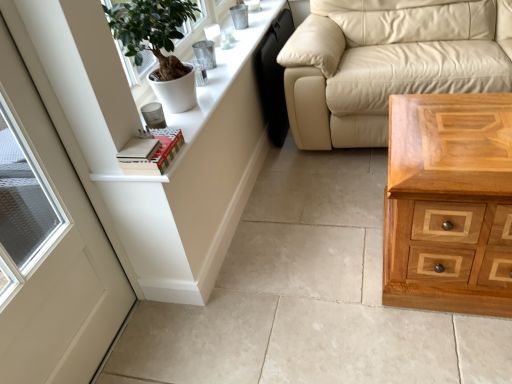
Where is `light brown wood chest of drawers at lower right`? light brown wood chest of drawers at lower right is located at coordinates point(449,203).

The width and height of the screenshot is (512, 384). I want to click on white wood dresser at upper left, so click(198, 178).

Where is `beige leather couch at upper right`? This screenshot has height=384, width=512. beige leather couch at upper right is located at coordinates (384, 64).

Is white matte pot at upper left situated inside white matte door at left or outside?

white matte pot at upper left exists outside the volume of white matte door at left.

Find the location of a particular element. The height and width of the screenshot is (384, 512). houseplant lying behind the white matte door at left is located at coordinates (152, 32).

Is white matte pot at upper left wider or thinner than white matte door at left?

Considering their sizes, white matte pot at upper left looks broader than white matte door at left.

Can you confirm if hardcover book at upper left is bigger than white wood dresser at upper left?

Incorrect, hardcover book at upper left is not larger than white wood dresser at upper left.

Does hardcover book at upper left lie behind white wood dresser at upper left?

No, hardcover book at upper left is in front of white wood dresser at upper left.

Is hardcover book at upper left turned away from white wood dresser at upper left?

hardcover book at upper left is not turned away from white wood dresser at upper left.

Does point (132, 159) come closer to viewer compared to point (259, 125)?

Yes, point (132, 159) is closer to viewer.

Based on the photo, which object is further away from the camera taking this photo, beige leather couch at upper right or light brown wood chest of drawers at lower right?

beige leather couch at upper right is behind.

Considering the relative sizes of beige leather couch at upper right and light brown wood chest of drawers at lower right in the image provided, is beige leather couch at upper right shorter than light brown wood chest of drawers at lower right?

Incorrect, the height of beige leather couch at upper right does not fall short of that of light brown wood chest of drawers at lower right.

Is light brown wood chest of drawers at lower right completely or partially inside beige leather couch at upper right?

No, light brown wood chest of drawers at lower right is not a part of beige leather couch at upper right.

In the scene shown: How many degrees apart are the facing directions of beige leather couch at upper right and light brown wood chest of drawers at lower right?

They differ by 0.23 degrees in their facing directions.

From a real-world perspective, which is physically above, light brown wood chest of drawers at lower right or beige leather couch at upper right?

beige leather couch at upper right, from a real-world perspective.

Is light brown wood chest of drawers at lower right closer to the viewer compared to beige leather couch at upper right?

Yes, it is in front of beige leather couch at upper right.

What are the coordinates of `studio couch above the light brown wood chest of drawers at lower right (from the image's perspective)` in the screenshot? It's located at (384, 64).

Which object is positioned more to the right, light brown wood chest of drawers at lower right or beige leather couch at upper right?

beige leather couch at upper right.

Does light brown wood chest of drawers at lower right turn towards hardcover book at upper left?

No.

Is the position of light brown wood chest of drawers at lower right more distant than that of hardcover book at upper left?

No, it is in front of hardcover book at upper left.

Are light brown wood chest of drawers at lower right and hardcover book at upper left far apart?

No, light brown wood chest of drawers at lower right is in close proximity to hardcover book at upper left.

Is light brown wood chest of drawers at lower right a part of white wood dresser at upper left?

No, light brown wood chest of drawers at lower right is not inside white wood dresser at upper left.

Is point (141, 252) farther from camera compared to point (467, 272)?

Yes, it is behind point (467, 272).

Is white wood dresser at upper left not close to light brown wood chest of drawers at lower right?

Actually, white wood dresser at upper left and light brown wood chest of drawers at lower right are a little close together.

Is white matte door at left taller than light brown wood chest of drawers at lower right?

Indeed, white matte door at left has a greater height compared to light brown wood chest of drawers at lower right.

Where is `door above the light brown wood chest of drawers at lower right (from a real-world perspective)`? door above the light brown wood chest of drawers at lower right (from a real-world perspective) is located at coordinates (56, 238).

Which object is further away from the camera taking this photo, white matte door at left or light brown wood chest of drawers at lower right?

Positioned behind is light brown wood chest of drawers at lower right.

Can you confirm if white matte door at left is positioned to the right of light brown wood chest of drawers at lower right?

In fact, white matte door at left is to the left of light brown wood chest of drawers at lower right.

Image resolution: width=512 pixels, height=384 pixels. In order to click on door below the white matte pot at upper left (from the image's perspective) in this screenshot , I will do `click(56, 238)`.

I want to click on dresser beneath the hardcover book at upper left (from a real-world perspective), so click(x=198, y=178).

Based on their spatial positions, is white matte pot at upper left or white matte door at left further from beige leather couch at upper right?

Among the two, white matte door at left is located further to beige leather couch at upper right.

Estimate the real-world distances between objects in this image. Which object is closer to white matte pot at upper left, white matte door at left or hardcover book at upper left?

Among the two, hardcover book at upper left is located nearer to white matte pot at upper left.

From the image, which object appears to be nearer to hardcover book at upper left, white matte pot at upper left or beige leather couch at upper right?

white matte pot at upper left.

Estimate the real-world distances between objects in this image. Which object is further from white wood dresser at upper left, light brown wood chest of drawers at lower right or hardcover book at upper left?

The object further to white wood dresser at upper left is light brown wood chest of drawers at lower right.

Which object lies further to the anchor point white matte pot at upper left, white wood dresser at upper left or beige leather couch at upper right?

beige leather couch at upper right lies further to white matte pot at upper left than the other object.

Considering their positions, is beige leather couch at upper right positioned further to light brown wood chest of drawers at lower right than white matte pot at upper left?

Based on the image, white matte pot at upper left appears to be further to light brown wood chest of drawers at lower right.

Estimate the real-world distances between objects in this image. Which object is closer to light brown wood chest of drawers at lower right, white wood dresser at upper left or white matte pot at upper left?

Among the two, white wood dresser at upper left is located nearer to light brown wood chest of drawers at lower right.

When comparing their distances from beige leather couch at upper right, does white wood dresser at upper left or hardcover book at upper left seem further?

hardcover book at upper left.

Find the location of `book between white matte door at left and light brown wood chest of drawers at lower right from left to right`. book between white matte door at left and light brown wood chest of drawers at lower right from left to right is located at coordinates (155, 154).

In order to click on dresser between white matte door at left and light brown wood chest of drawers at lower right in the horizontal direction in this screenshot , I will do `click(198, 178)`.

What are the coordinates of `houseplant that lies between white wood dresser at upper left and hardcover book at upper left from top to bottom` in the screenshot? It's located at (152, 32).

I want to click on the chest of drawers situated between hardcover book at upper left and beige leather couch at upper right from left to right, so click(x=449, y=203).